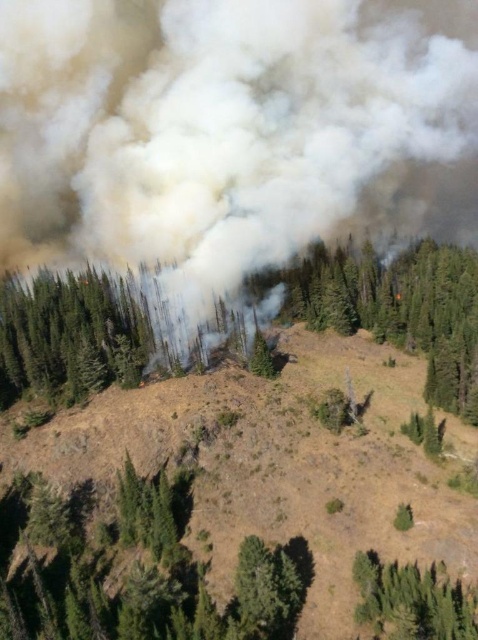
Question: Does green leafy tree at center appear under green leafy tree at lower right?

Choices:
 (A) yes
 (B) no

Answer: (B)

Question: Does green leafy tree at center appear under green matte tree at center-left?

Choices:
 (A) yes
 (B) no

Answer: (B)

Question: Is green leafy tree at center to the left of green matte tree at center-left from the viewer's perspective?

Choices:
 (A) yes
 (B) no

Answer: (B)

Question: Which is nearer to the green leafy tree at center?

Choices:
 (A) green rough bark tree at center
 (B) green matte tree at center-left
 (C) green leafy tree at lower right
 (D) white smoke at center

Answer: (B)

Question: Which point is farther to the camera?

Choices:
 (A) (364, 244)
 (B) (49, 300)
 (C) (433, 593)

Answer: (A)

Question: Considering the real-world distances, which object is farthest from the white smoke at center?

Choices:
 (A) green leafy tree at center
 (B) green matte tree at center-left

Answer: (A)